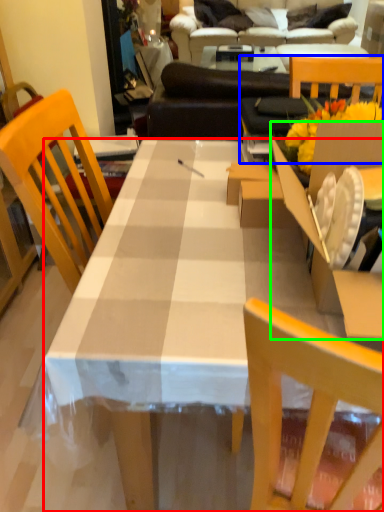
Question: Which is farther away from desk (highlighted by a red box)? chair (highlighted by a blue box) or cardboard box (highlighted by a green box)?

Choices:
 (A) chair
 (B) cardboard box

Answer: (A)